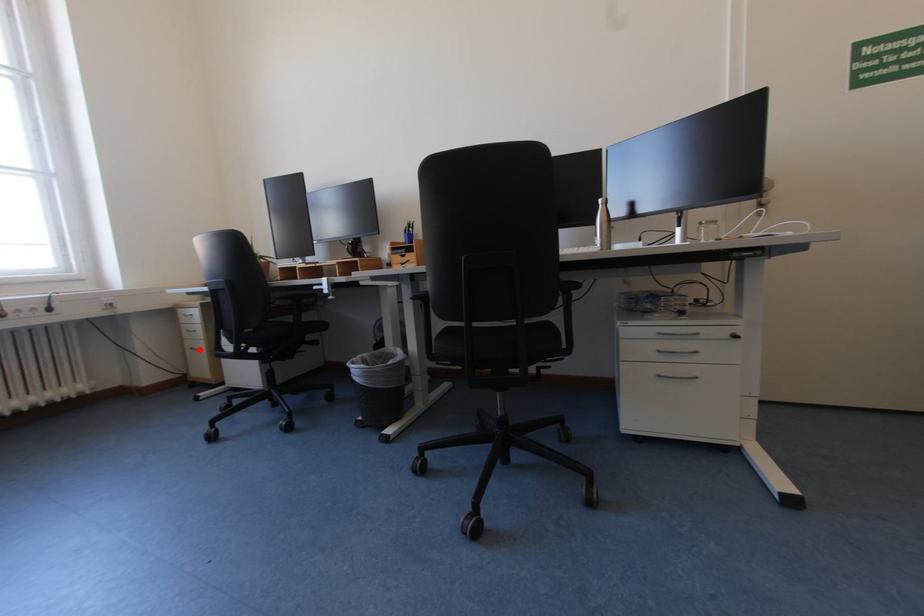
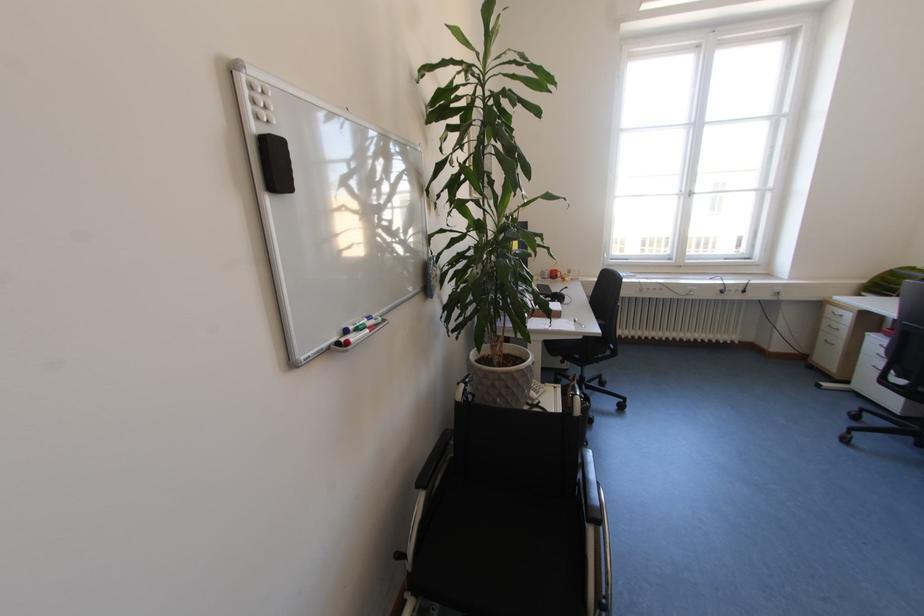
Question: A red point is marked in image1. In image2, is the corresponding 3D point closer to the camera or farther? Reply with the corresponding letter.

Choices:
 (A) The corresponding 3D point is closer.
 (B) The corresponding 3D point is farther.

Answer: (B)